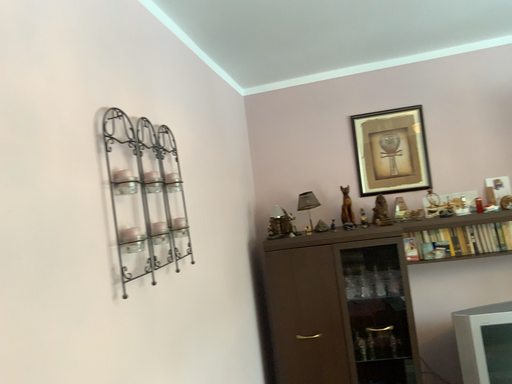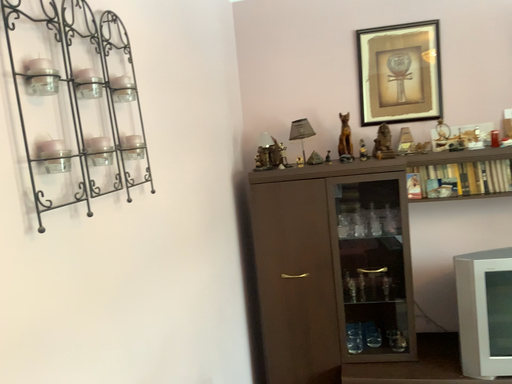
Question: How did the camera likely rotate when shooting the video?

Choices:
 (A) rotated downward
 (B) rotated upward

Answer: (A)